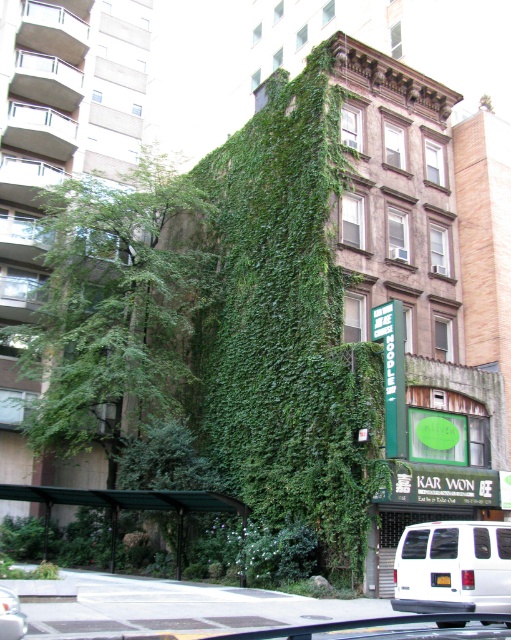
You are standing at the point marked by the coordinates (453, 566) in the image. What object is exactly at this location?

The white matte van at lower right is exactly at the coordinates (453, 566).

You are a delivery person needing to place a package between the green leafy ivy at center and the green leafy tree at left. The package requires a space of 4 meters to fit. Can you place it there?

The distance between the green leafy ivy at center and the green leafy tree at left is 3.87 meters, which is less than the required 4 meters. Therefore, the package cannot be placed there.

You are a delivery person who needs to park your white matte van at lower right and white matte van at lower left near the ivy covered building. Given the layout described, which van is positioned closer to the storefront with the green signboard?

The white matte van at lower right is positioned to the right of the white matte van at lower left. Since the storefront with the green signboard is located to the right of the ivy covered building, the white matte van at lower right is closer to the storefront.